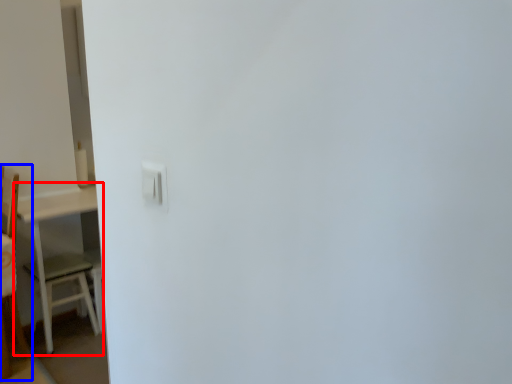
Question: Among these objects, which one is nearest to the camera, table (highlighted by a red box) or furniture (highlighted by a blue box)?

Choices:
 (A) table
 (B) furniture

Answer: (B)